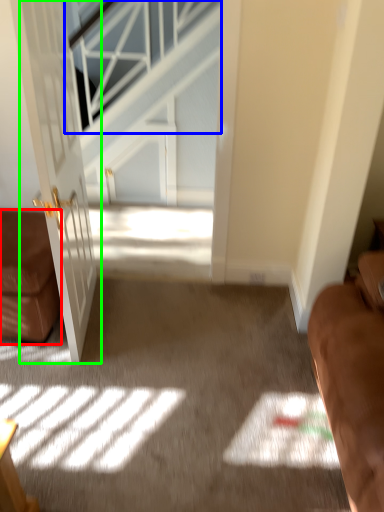
Question: Estimate the real-world distances between objects in this image. Which object is closer to furniture (highlighted by a red box), window (highlighted by a blue box) or door (highlighted by a green box)?

Choices:
 (A) window
 (B) door

Answer: (B)